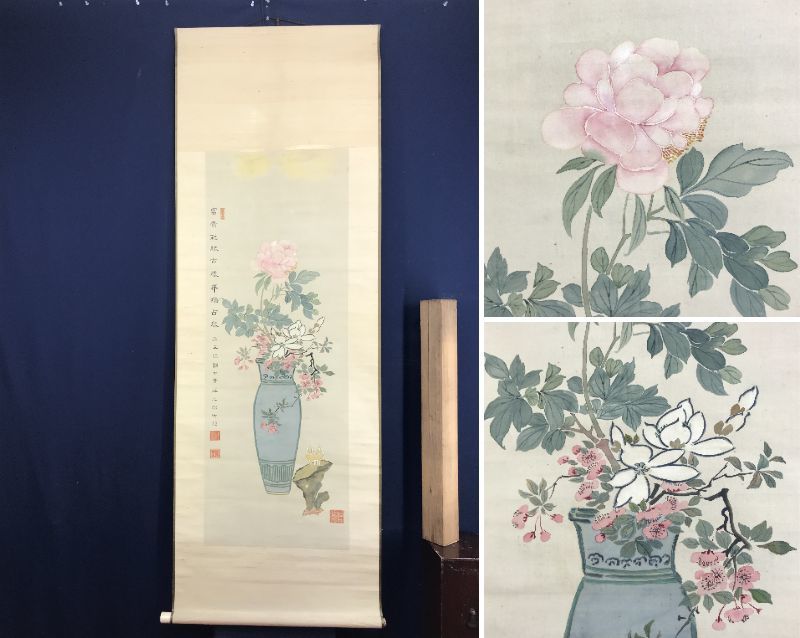
Image resolution: width=800 pixels, height=638 pixels. Find the location of `painting`. painting is located at coordinates (298, 352).